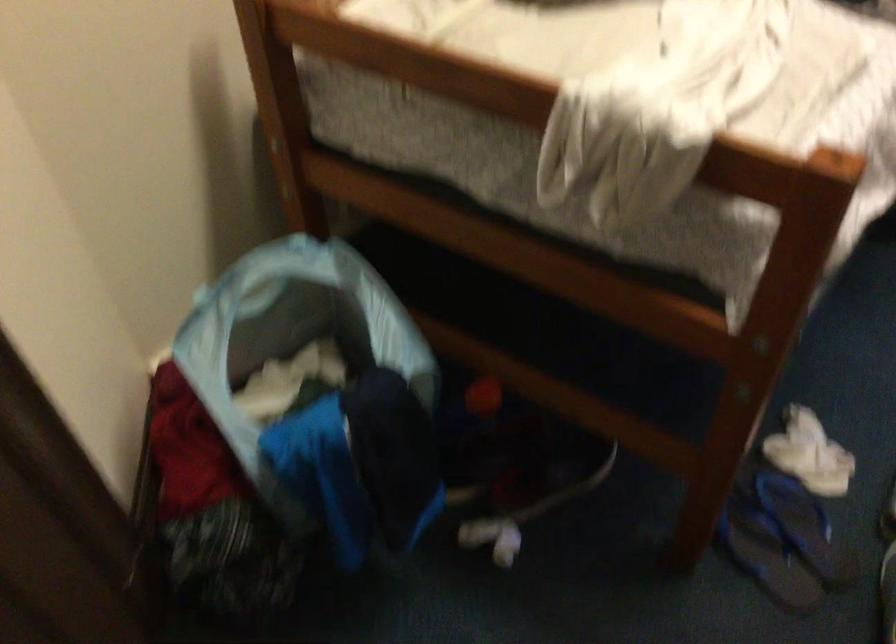
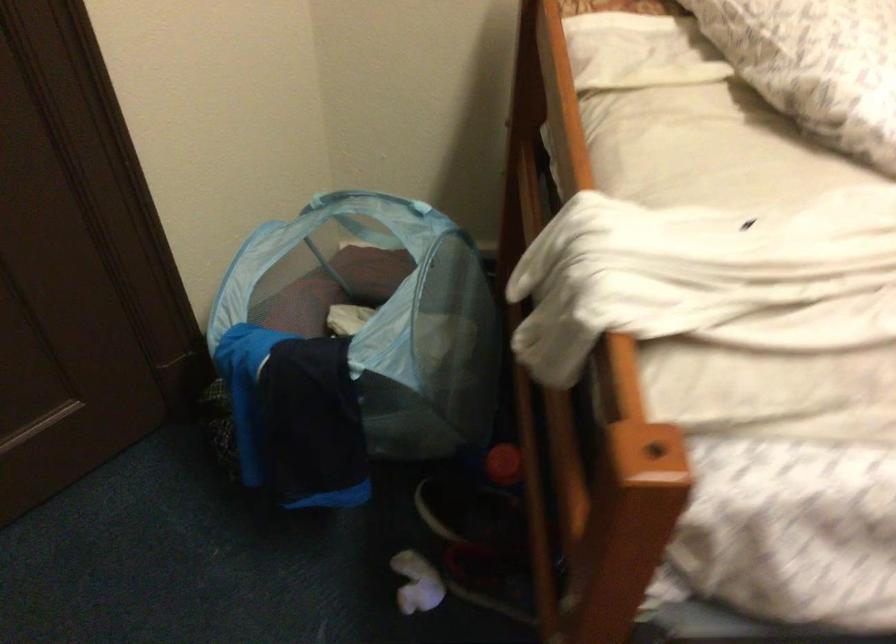
Find the pixel in the second image that matches the point at 470,460 in the first image.

(469, 509)